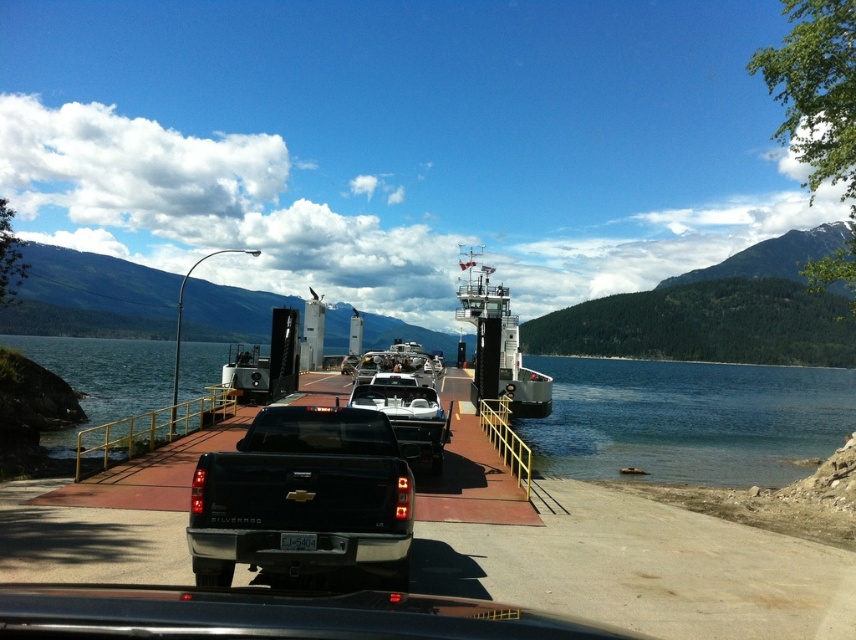
Based on the photo, you are standing on the ferry dock and want to board the ferry. You see the clear water at center and the metallic gray boat at center. Which one is to your right?

The clear water at center is positioned on the right side of metallic gray boat at center, so the clear water at center is to your right.

You are a passenger on the ferry and want to board the metallic gray boat at center. Which direction should you walk from the metallic silver boat at center to reach it?

To board the metallic gray boat at center from the metallic silver boat at center, you should walk to the right since the metallic gray boat at center is located to the right of the metallic silver boat at center.